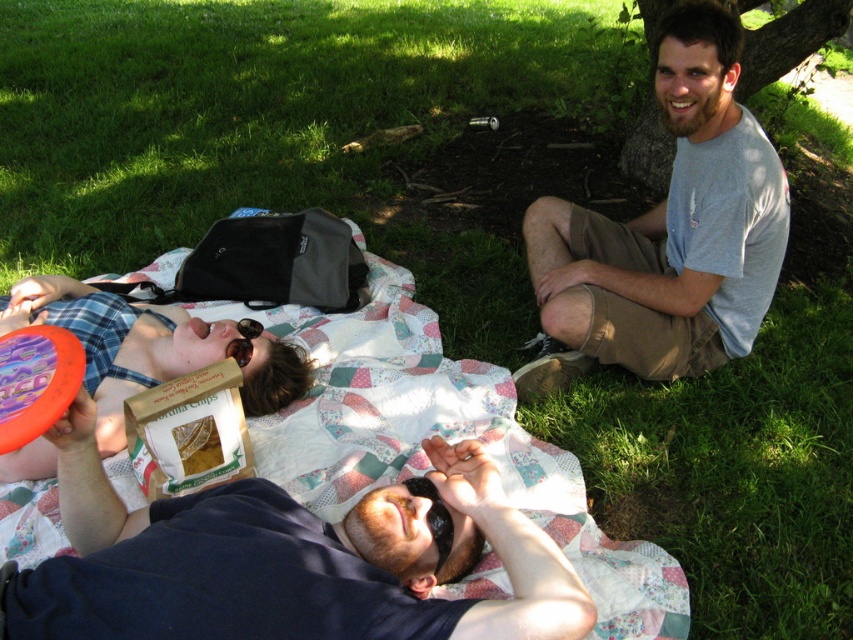
Does matte black sunglasses at lower center have a greater width compared to matte brown bag at upper left?

Yes, matte black sunglasses at lower center is wider than matte brown bag at upper left.

Measure the distance between matte black sunglasses at lower center and camera.

A distance of 4.22 feet exists between matte black sunglasses at lower center and camera.

Image resolution: width=853 pixels, height=640 pixels. Identify the location of matte black sunglasses at lower center. (288, 560).

Who is shorter, matte black sunglasses at lower center or gray cotton shirt at upper right?

matte black sunglasses at lower center is shorter.

Between point (161, 582) and point (728, 250), which one is positioned in front?

Point (161, 582) is in front.

Find the location of a particular element. The width and height of the screenshot is (853, 640). matte black sunglasses at lower center is located at coordinates (288, 560).

Is gray cotton shirt at upper right taller than matte brown bag at upper left?

Yes, gray cotton shirt at upper right is taller than matte brown bag at upper left.

Between gray cotton shirt at upper right and matte brown bag at upper left, which one appears on the right side from the viewer's perspective?

gray cotton shirt at upper right

Who is more distant from viewer, (598, 236) or (113, 406)?

Positioned behind is point (598, 236).

Locate an element on the screen. This screenshot has width=853, height=640. gray cotton shirt at upper right is located at coordinates (666, 234).